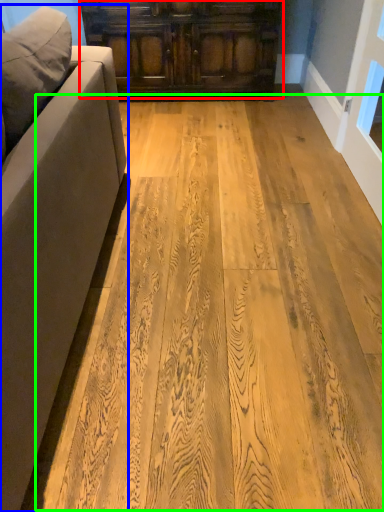
Question: Which is nearer to the cabinetry (highlighted by a red box)? studio couch (highlighted by a blue box) or plywood (highlighted by a green box).

Choices:
 (A) studio couch
 (B) plywood

Answer: (B)